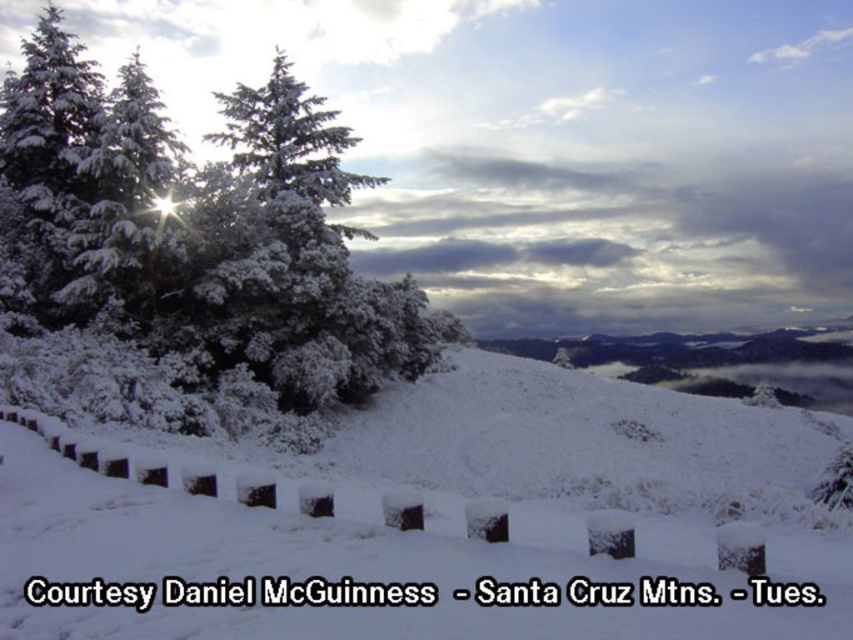
Question: Is white matte snow at center further to camera compared to snow-covered evergreen at upper left?

Choices:
 (A) yes
 (B) no

Answer: (B)

Question: Does white matte snow at center appear on the left side of snow-covered evergreen at upper left?

Choices:
 (A) no
 (B) yes

Answer: (A)

Question: Can you confirm if white matte snow at center is positioned to the right of snow-covered evergreen at upper left?

Choices:
 (A) no
 (B) yes

Answer: (B)